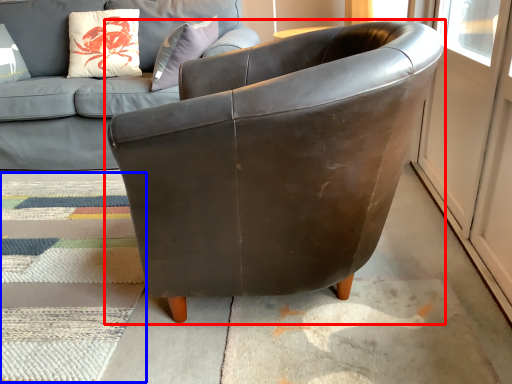
Question: Which of the following is the farthest to the observer, chair (highlighted by a red box) or mat (highlighted by a blue box)?

Choices:
 (A) chair
 (B) mat

Answer: (B)